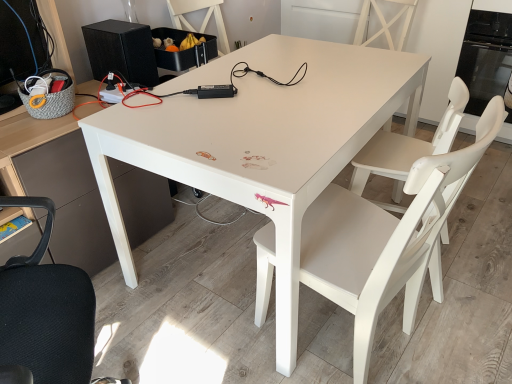
Question: From the image's perspective, is white matte chair at center above white matte table at center?

Choices:
 (A) no
 (B) yes

Answer: (A)

Question: Can you confirm if white matte chair at center is taller than white matte table at center?

Choices:
 (A) no
 (B) yes

Answer: (B)

Question: Does white matte chair at center contain white matte table at center?

Choices:
 (A) no
 (B) yes

Answer: (A)

Question: From a real-world perspective, is white matte chair at center beneath white matte table at center?

Choices:
 (A) no
 (B) yes

Answer: (A)

Question: Can you confirm if white matte chair at center is shorter than white matte table at center?

Choices:
 (A) yes
 (B) no

Answer: (B)

Question: Is white matte chair at center further to camera compared to white matte table at center?

Choices:
 (A) yes
 (B) no

Answer: (B)

Question: Is black glass oven at upper right thinner than matte black desk at left?

Choices:
 (A) no
 (B) yes

Answer: (A)

Question: Considering the relative sizes of black glass oven at upper right and matte black desk at left in the image provided, is black glass oven at upper right bigger than matte black desk at left?

Choices:
 (A) no
 (B) yes

Answer: (A)

Question: From the image's perspective, is black glass oven at upper right on top of matte black desk at left?

Choices:
 (A) yes
 (B) no

Answer: (A)

Question: Is black glass oven at upper right further to camera compared to matte black desk at left?

Choices:
 (A) no
 (B) yes

Answer: (B)

Question: Is black glass oven at upper right not within matte black desk at left?

Choices:
 (A) no
 (B) yes

Answer: (B)

Question: Is black glass oven at upper right far away from matte black desk at left?

Choices:
 (A) no
 (B) yes

Answer: (B)

Question: Is white matte chair at center positioned in front of matte black desk at left?

Choices:
 (A) yes
 (B) no

Answer: (B)